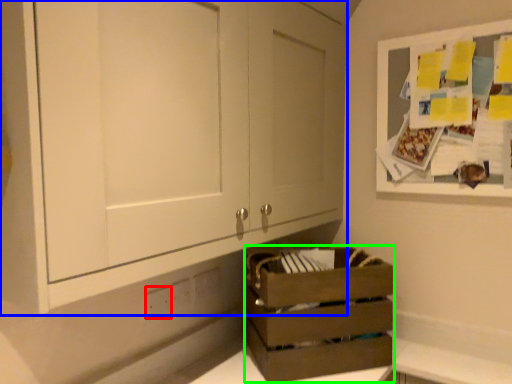
Question: Which is farther away from electric outlet (highlighted by a red box)? cabinetry (highlighted by a blue box) or crate (highlighted by a green box)?

Choices:
 (A) cabinetry
 (B) crate

Answer: (A)